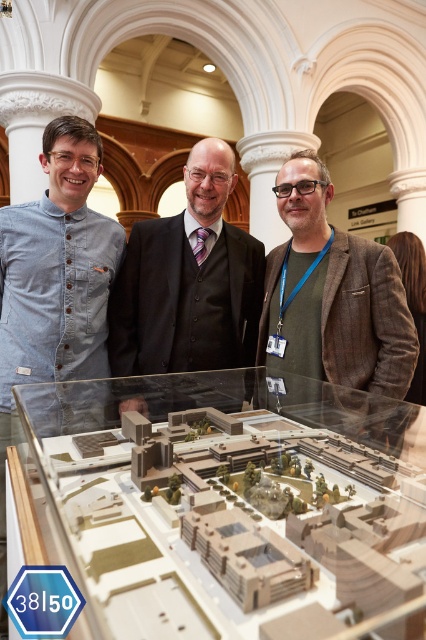
Is the position of brown tweed blazer at center less distant than that of brown textured suit at center?

Yes, it is in front of brown textured suit at center.

Can you confirm if brown tweed blazer at center is wider than brown textured suit at center?

In fact, brown tweed blazer at center might be narrower than brown textured suit at center.

Between point (299, 378) and point (132, 276), which one is positioned behind?

Positioned behind is point (132, 276).

The width and height of the screenshot is (426, 640). I want to click on brown tweed blazer at center, so click(x=333, y=300).